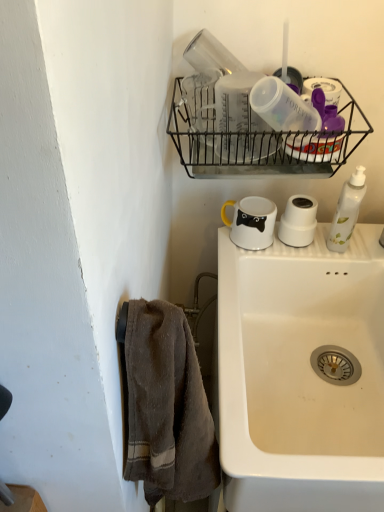
Question: From the image's perspective, relative to brown textured towel at left, is black wire basket at upper center above or below?

Choices:
 (A) above
 (B) below

Answer: (A)

Question: Looking at their shapes, would you say black wire basket at upper center is wider or thinner than brown textured towel at left?

Choices:
 (A) wide
 (B) thin

Answer: (A)

Question: Based on their relative distances, which object is farther from the white plastic soap dispenser at right?

Choices:
 (A) white matte toilet paper at upper center
 (B) white glossy mug at upper center
 (C) white ceramic sink at lower right
 (D) black wire basket at upper center
 (E) brown textured towel at left

Answer: (E)

Question: Which is farther from the white matte toilet paper at upper center?

Choices:
 (A) white glossy mug at upper center
 (B) white ceramic sink at lower right
 (C) brown textured towel at left
 (D) white plastic soap dispenser at right
 (E) black wire basket at upper center

Answer: (C)